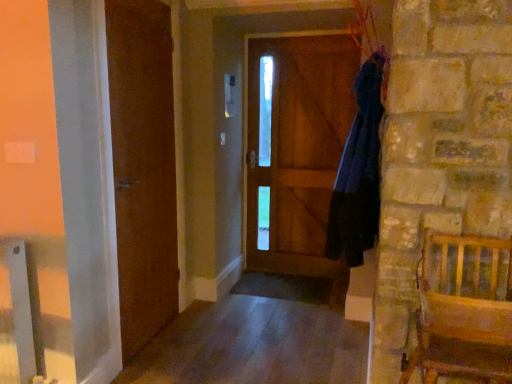
The width and height of the screenshot is (512, 384). Identify the location of unoccupied area in front of brown wooden door at left. (167, 367).